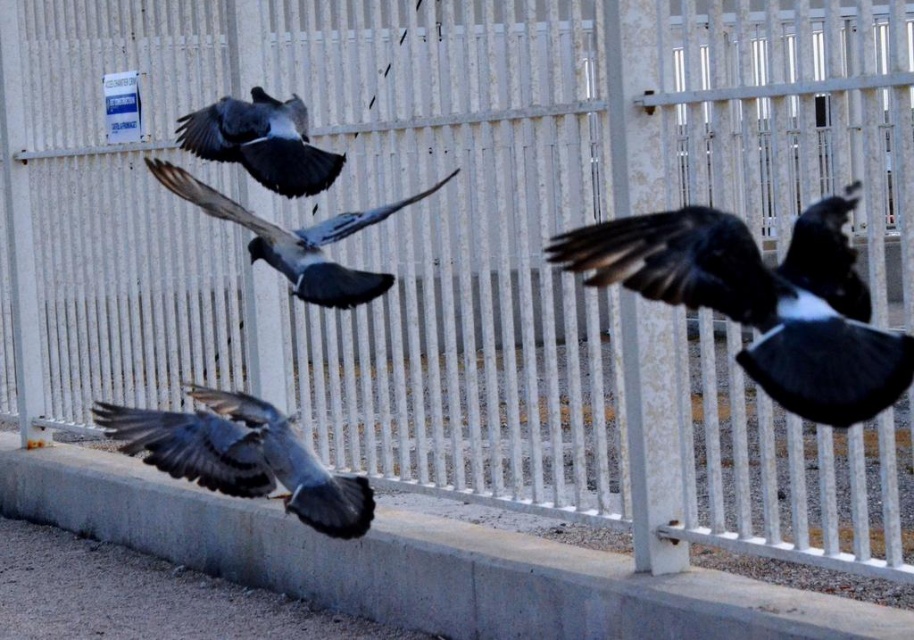
Is gray matte pigeon at lower left bigger than gray matte pigeon at center?

Actually, gray matte pigeon at lower left might be smaller than gray matte pigeon at center.

Is point (291, 454) less distant than point (285, 268)?

Yes, point (291, 454) is in front of point (285, 268).

Locate an element on the screen. This screenshot has width=914, height=640. gray matte pigeon at lower left is located at coordinates tap(242, 456).

Can you confirm if gray matte pigeon at center is positioned below gray matte pigeon at upper center?

Indeed, gray matte pigeon at center is positioned under gray matte pigeon at upper center.

Is point (279, 237) farther from camera compared to point (219, 108)?

No, it is in front of (219, 108).

I want to click on gray matte pigeon at center, so click(295, 241).

Does black glossy bird at right have a smaller size compared to gray matte pigeon at upper center?

No, black glossy bird at right is not smaller than gray matte pigeon at upper center.

Is point (677, 232) in front of point (317, 180)?

Yes.

Which is in front, point (641, 253) or point (230, 120)?

Point (641, 253) is in front.

At what (x,y) coordinates should I click in order to perform the action: click on black glossy bird at right. Please return your answer as a coordinate pair (x, y). The image size is (914, 640). Looking at the image, I should click on (761, 300).